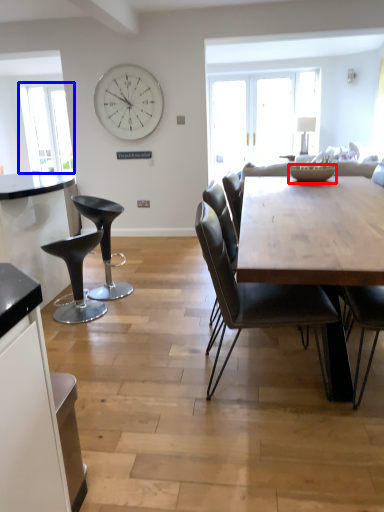
Question: Which point is further to the camera, bowl (highlighted by a red box) or window screen (highlighted by a blue box)?

Choices:
 (A) bowl
 (B) window screen

Answer: (B)